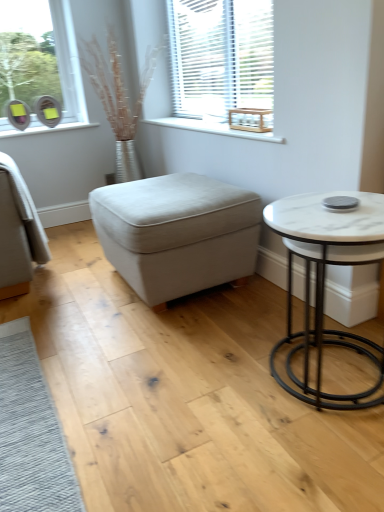
What are the coordinates of `free location in front of white marble table at right` in the screenshot? It's located at (312, 463).